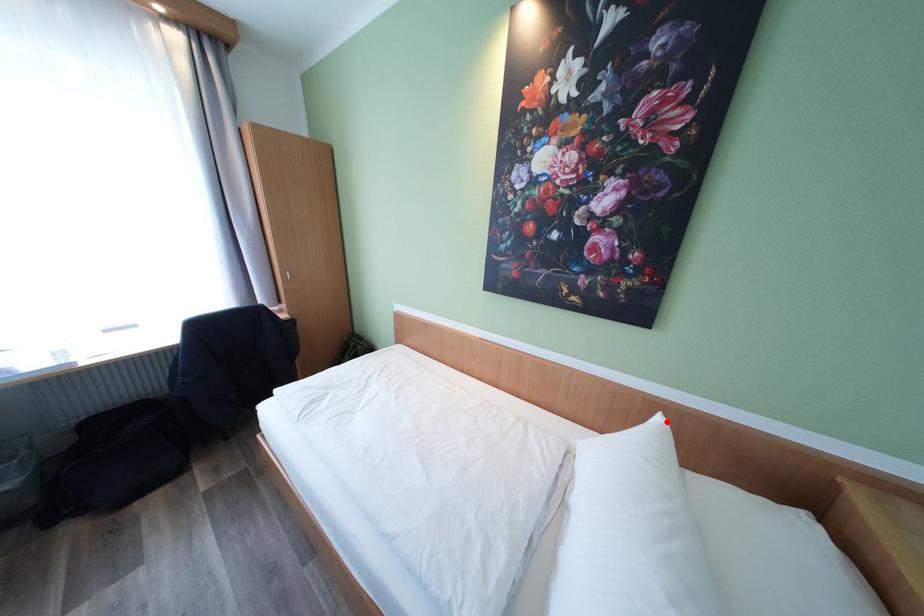
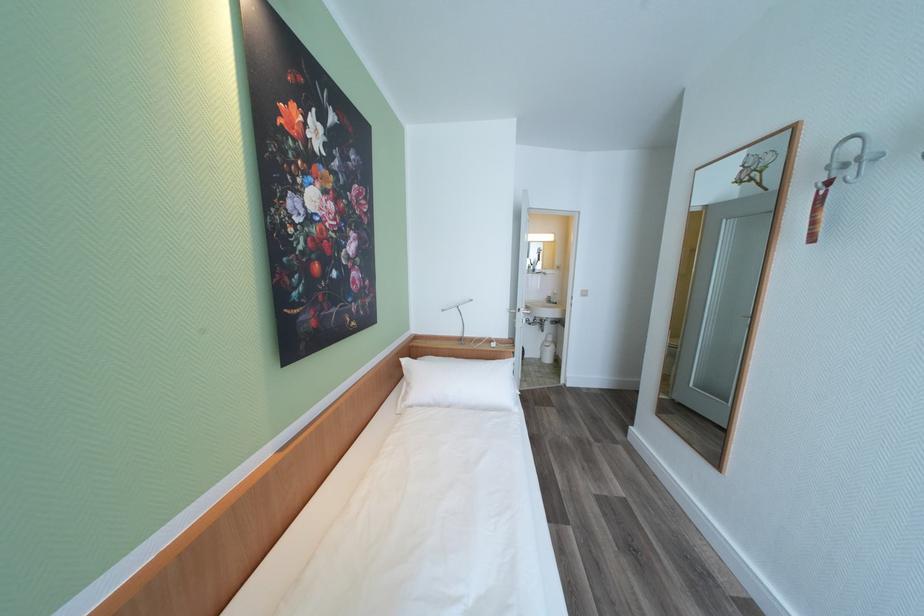
Locate, in the second image, the point that corresponds to the highlighted location in the first image.

(411, 362)